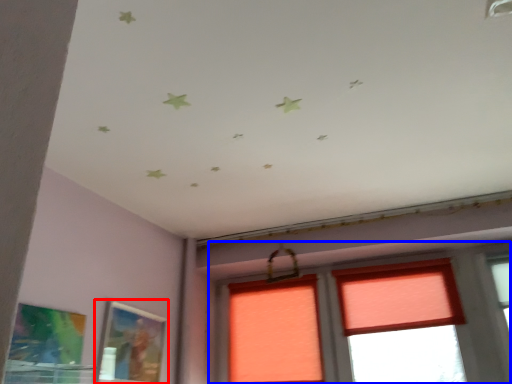
Question: Which point is closer to the camera, picture frame (highlighted by a red box) or window (highlighted by a blue box)?

Choices:
 (A) picture frame
 (B) window

Answer: (A)